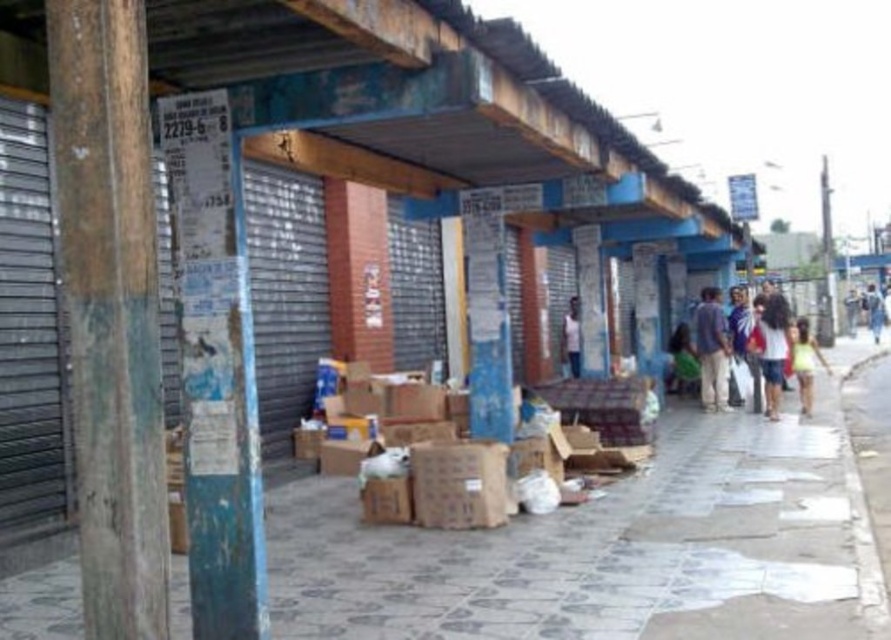
You are a delivery person trying to deliver a package to the address located at the center of the street scene. You see the light brown fabric pants at center and the light blue denim shorts at lower right. Which item is narrower and could potentially be used to navigate through a narrow space to reach the delivery point?

The light brown fabric pants at center is thinner than the light blue denim shorts at lower right, so it is narrower and could be used to navigate through a narrow space to reach the delivery point.

You are a delivery person who needs to place a large package on the sidewalk. You see the light brown fabric pants at center and the light blue denim shorts at lower right. Which object should you avoid placing the package near to ensure there is enough space?

You should avoid placing the package near the light brown fabric pants at center because it has a smaller size compared to the light blue denim shorts at lower right, meaning there is less space around it.